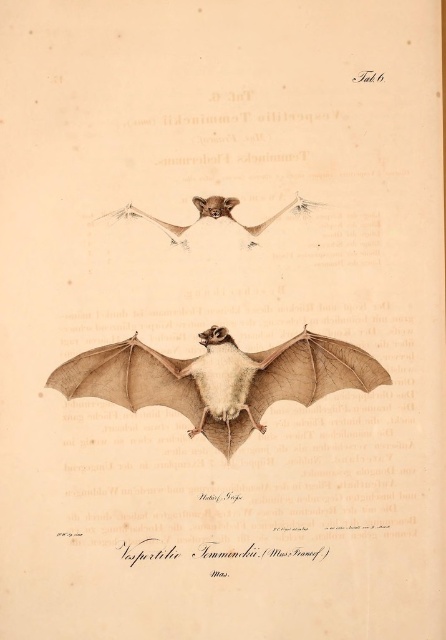
Does brown textured wing at center have a lesser width compared to brown textured bat at center?

Incorrect, brown textured wing at center's width is not less than brown textured bat at center's.

Measure the distance between brown textured wing at center and brown textured bat at center.

brown textured wing at center and brown textured bat at center are 1.16 meters apart.

Does point (195, 429) come farther from viewer compared to point (234, 202)?

That is False.

I want to click on brown textured wing at center, so click(x=199, y=388).